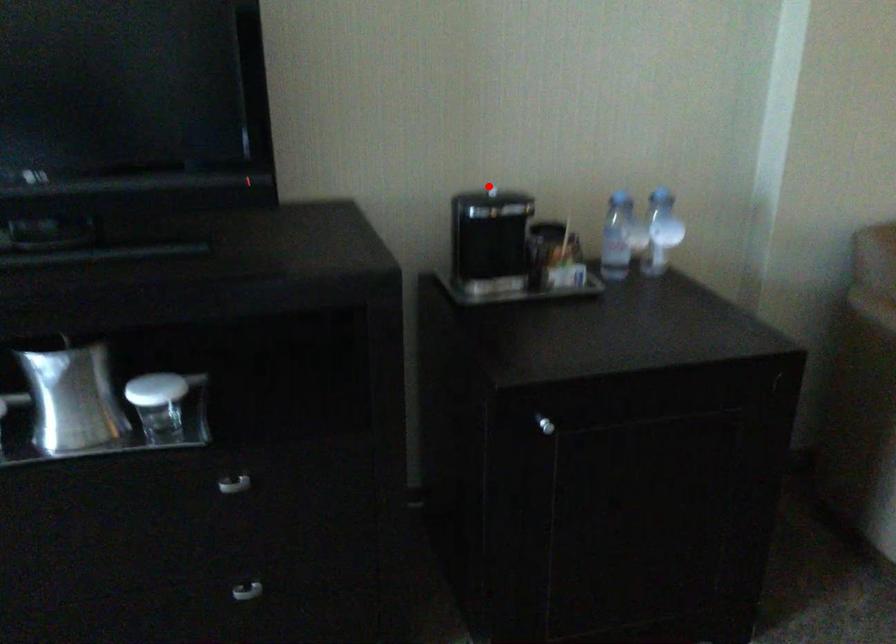
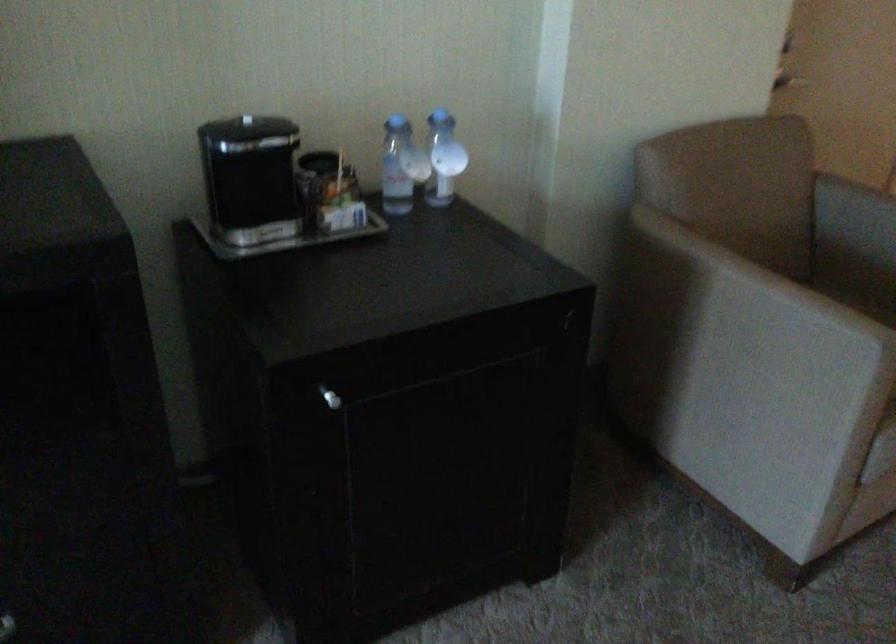
Question: I am providing you with two images of the same scene from different viewpoints. In image1, a red point is highlighted. Considering the same 3D point in image2, which of the following is correct?

Choices:
 (A) It is closer
 (B) It is farther

Answer: (A)